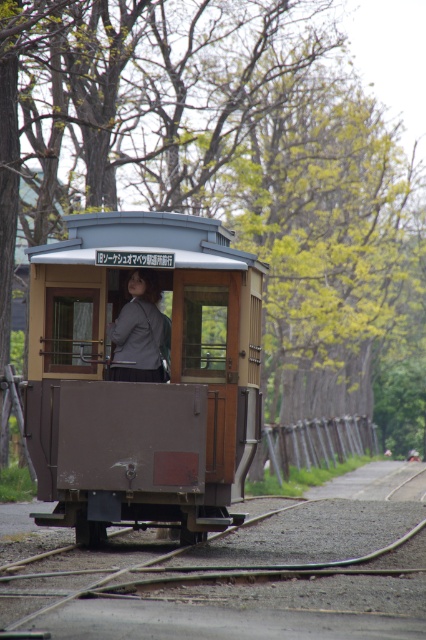
You are standing at the center of the image and see the brown wooden train car at center and the matte gray blazer at center. Which object is closer to your right side?

The brown wooden train car at center is closer to your right side because it is positioned to the right of the matte gray blazer at center.

You are a passenger standing on the platform waiting for the tram. You notice both the brown wooden train car at center and the matte gray blazer at center. Which object is taller?

The brown wooden train car at center is taller than the matte gray blazer at center.